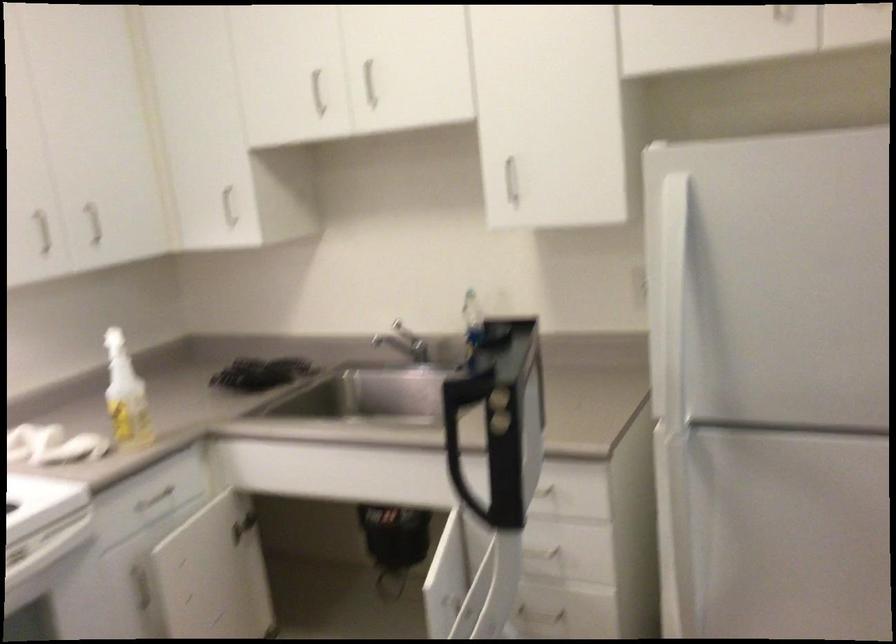
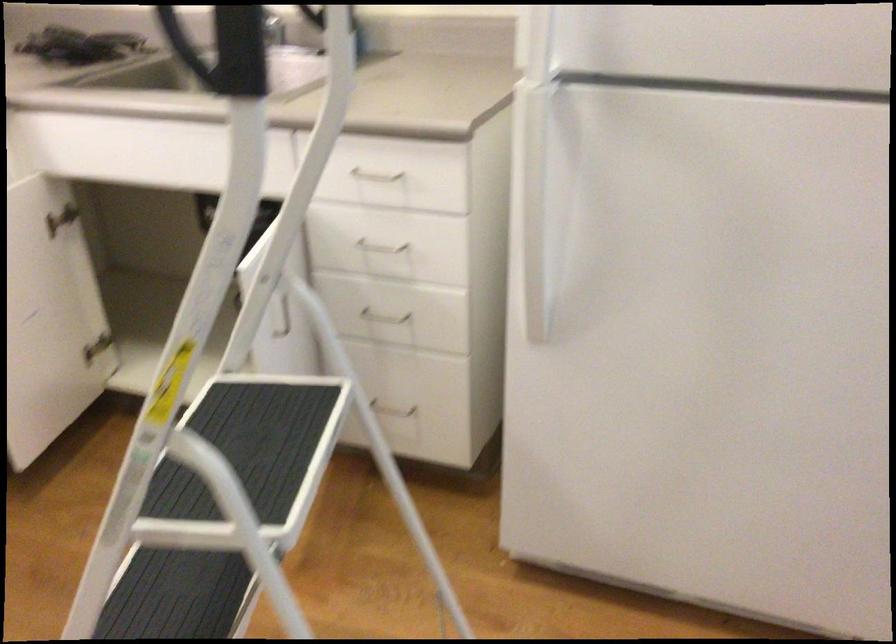
Question: Based on the continuous images, in which direction is the camera rotating? Reply with the corresponding letter.

Choices:
 (A) Left
 (B) Right
 (C) Up
 (D) Down

Answer: (D)